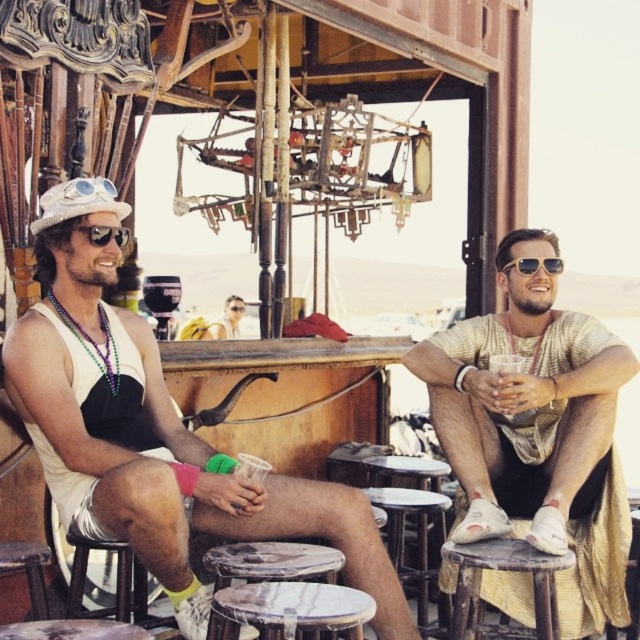
Question: Where is white marble stool at lower center located in relation to gold metallic sunglasses at right in the image?

Choices:
 (A) below
 (B) above

Answer: (A)

Question: Estimate the real-world distances between objects in this image. Which object is closer to the woven wood stool at lower right?

Choices:
 (A) wooden textured stool at lower center
 (B) gold metallic sunglasses at right
 (C) wooden bar stool at lower left
 (D) matte black sunglasses at center

Answer: (A)

Question: Can you confirm if wooden textured stool at lower center is smaller than matte black sunglasses at center?

Choices:
 (A) no
 (B) yes

Answer: (A)

Question: Which of these objects is positioned closest to the woven wood stool at lower right?

Choices:
 (A) matte black goggles at left
 (B) gold metallic sunglasses at right
 (C) white marble stool at lower center
 (D) wooden bar stool at lower left

Answer: (C)

Question: Which point is closer to the camera?

Choices:
 (A) matte black sunglasses at center
 (B) matte gold shirt at center
 (C) woven wood stool at lower right
 (D) wooden bar stool at lower left

Answer: (D)

Question: Can you confirm if wooden bar stool at lower left is smaller than gold metallic sunglasses at right?

Choices:
 (A) yes
 (B) no

Answer: (B)